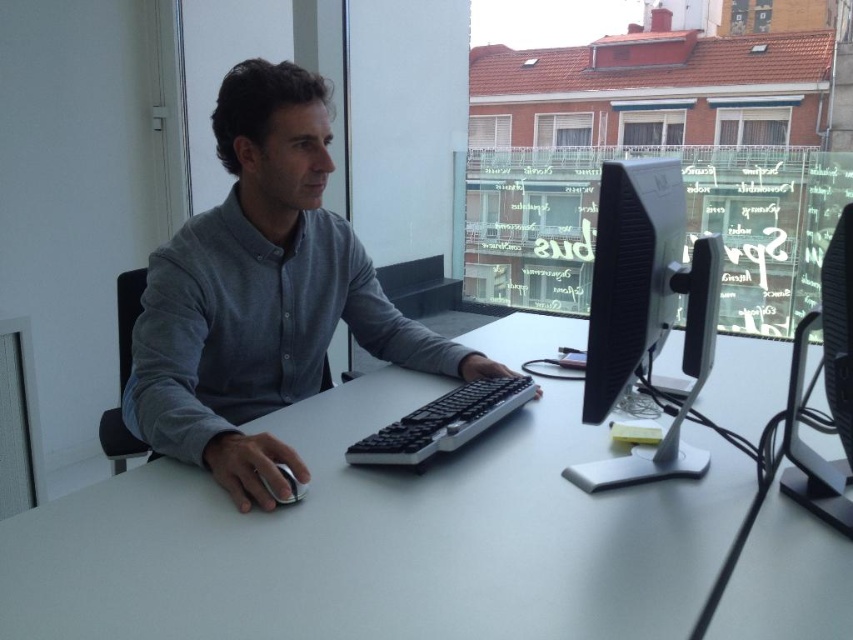
Based on the scene description, what are the coordinates of the white matte table at center?

The white matte table at center is located at coordinates point (381, 540).

Based on the scene description, what are the coordinates of the gray matte shirt at center?

The coordinates of the gray matte shirt at center are at point (262, 294).

You are a delivery robot with a box that is 16 inches long. You need to place the box on the white matte table at center without overlapping the white glossy mouse at lower left. Is there enough space between them?

The distance between the white matte table at center and the white glossy mouse at lower left is 16.90 inches. Since the box is 16 inches long, there is enough space to place it without overlapping.